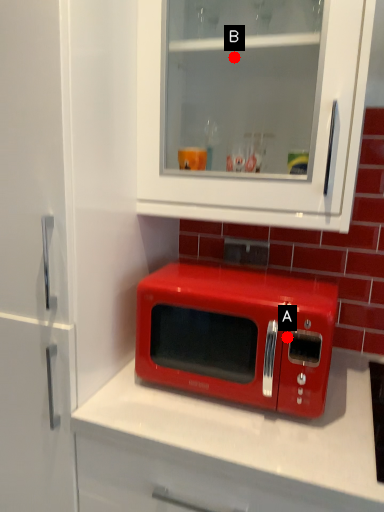
Question: Two points are circled on the image, labeled by A and B beside each circle. Which point appears farthest from the camera in this image?

Choices:
 (A) A is further
 (B) B is further

Answer: (B)